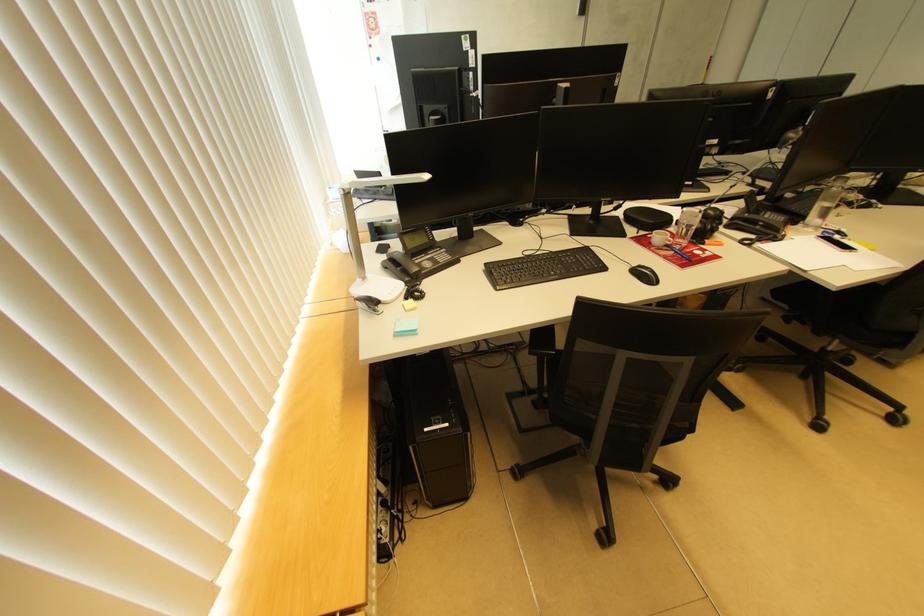
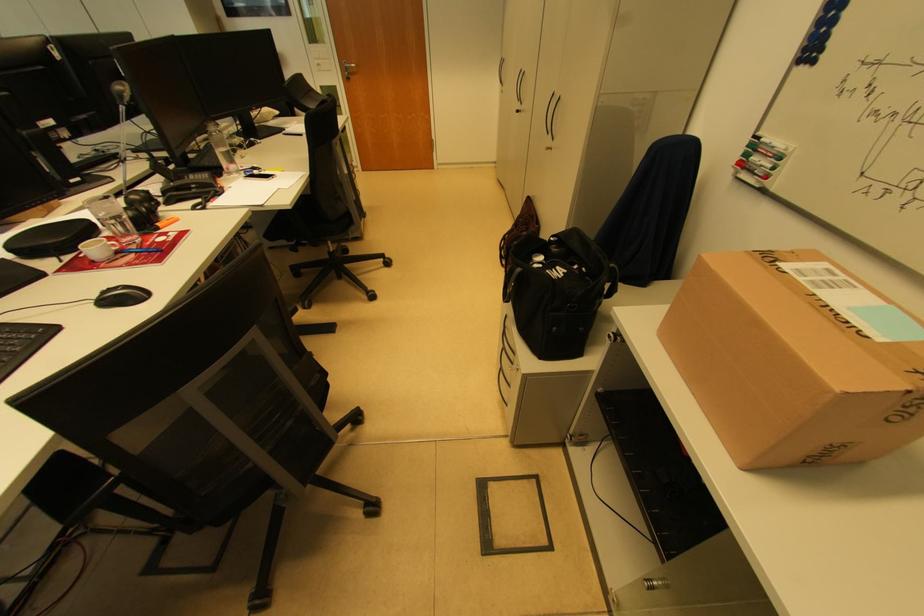
Based on the photo, first-person continuous shooting, in which direction is the camera rotating?

The camera rotated toward right-down.